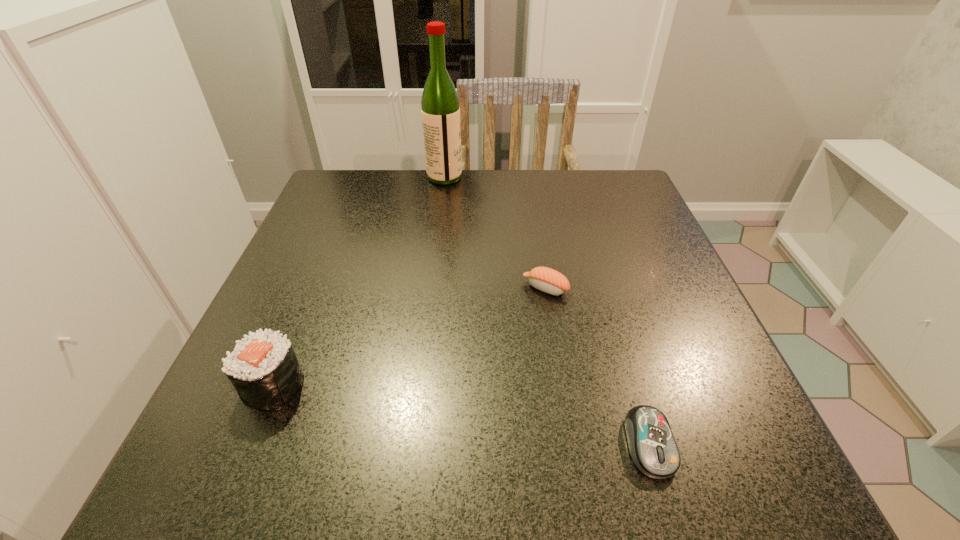
The height and width of the screenshot is (540, 960). In order to click on vacant position located on the left of the second object from right to left in this screenshot , I will do tap(391, 288).

This screenshot has height=540, width=960. Identify the location of object at the far edge. (440, 111).

Locate an element on the screen. This screenshot has width=960, height=540. object that is at the near edge is located at coordinates (652, 446).

You are a GUI agent. You are given a task and a screenshot of the screen. Output one action in this format:
    pyautogui.click(x=<x>, y=<y>)
    Task: Click on the object present at the left edge
    
    Given the screenshot: What is the action you would take?
    pyautogui.click(x=263, y=368)

Find the location of a particular element. This screenshot has width=960, height=540. object that is at the right edge is located at coordinates (652, 446).

You are a GUI agent. You are given a task and a screenshot of the screen. Output one action in this format:
    pyautogui.click(x=<x>, y=<y>)
    Task: Click on the object situated at the near right corner
    This screenshot has width=960, height=540.
    Given the screenshot: What is the action you would take?
    pyautogui.click(x=652, y=446)

Identify the location of vacant area at the far edge of the desktop. (471, 192).

The image size is (960, 540). In order to click on vacant space at the near edge of the desktop in this screenshot , I will do `click(570, 481)`.

This screenshot has width=960, height=540. I want to click on vacant position at the left edge of the desktop, so click(x=304, y=242).

Identify the location of free space at the right edge of the desktop. This screenshot has width=960, height=540. (672, 262).